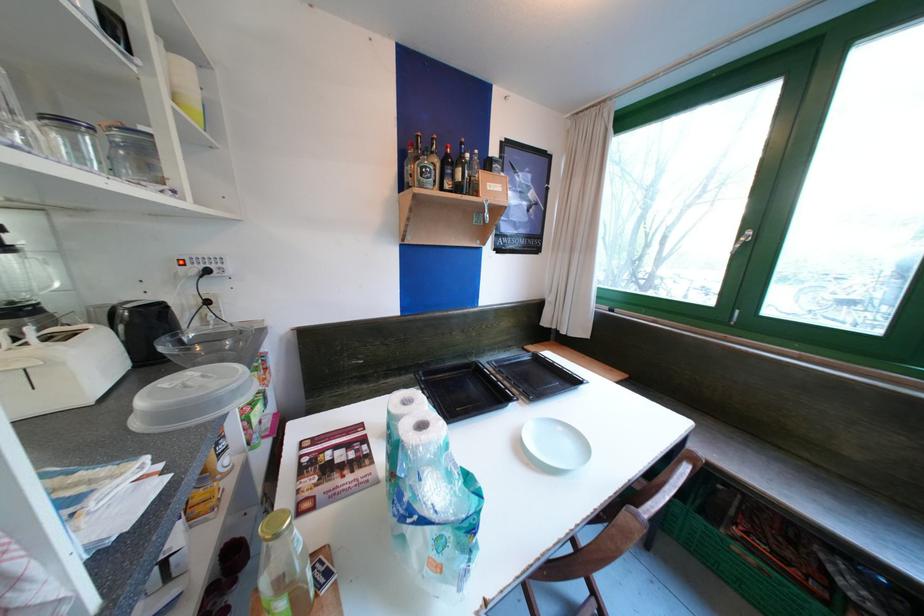
Find the location of a particular element. sofa sitting surface is located at coordinates (813, 493).